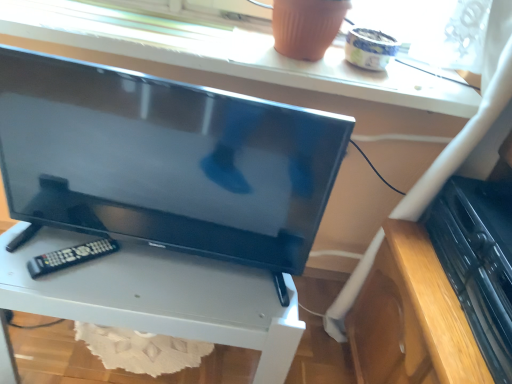
Question: Which is correct: matte white window sill at upper center is inside black plastic dvd player at lower right, or outside of it?

Choices:
 (A) outside
 (B) inside

Answer: (A)

Question: Relative to black plastic dvd player at lower right, is matte white window sill at upper center in front or behind?

Choices:
 (A) behind
 (B) front

Answer: (A)

Question: Which is farther from the black plastic dvd player at lower right?

Choices:
 (A) matte white window sill at upper center
 (B) matte black tv at center
 (C) white glossy tv stand at center
 (D) black plastic remote at lower left

Answer: (D)

Question: Estimate the real-world distances between objects in this image. Which object is farther from the matte white window sill at upper center?

Choices:
 (A) white glossy tv stand at center
 (B) black plastic dvd player at lower right
 (C) black plastic remote at lower left
 (D) matte black tv at center

Answer: (C)